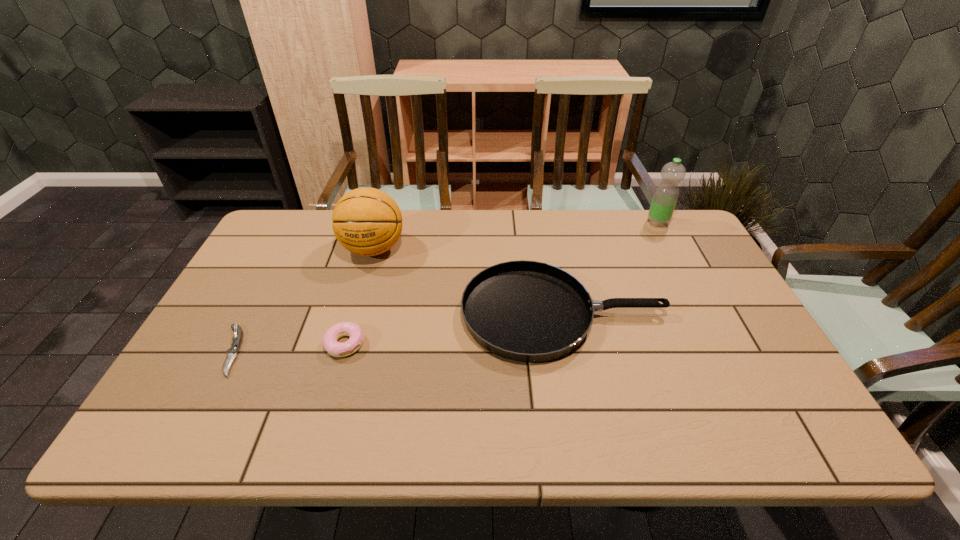
I want to click on blank area located 0.170m on the handle side of the third tallest object, so click(x=728, y=314).

Where is `free space located on the back of the doughnut`? The height and width of the screenshot is (540, 960). free space located on the back of the doughnut is located at coordinates (371, 254).

Find the location of `free region located on the right of the shortest object`. free region located on the right of the shortest object is located at coordinates (295, 351).

Locate an element on the screen. Image resolution: width=960 pixels, height=540 pixels. water bottle that is at the far edge is located at coordinates (665, 197).

Image resolution: width=960 pixels, height=540 pixels. I want to click on basketball that is at the far edge, so pos(366,221).

You are a GUI agent. You are given a task and a screenshot of the screen. Output one action in this format:
    pyautogui.click(x=<x>, y=<y>)
    Task: Click on the object present at the left edge
    
    Given the screenshot: What is the action you would take?
    pyautogui.click(x=237, y=339)

This screenshot has width=960, height=540. Find the location of `object that is at the right edge`. object that is at the right edge is located at coordinates (665, 197).

Image resolution: width=960 pixels, height=540 pixels. What are the coordinates of `object that is at the far right corner` in the screenshot? It's located at (665, 197).

Locate an element on the screen. vacant space at the far edge of the desktop is located at coordinates (578, 249).

In the image, there is a desktop. Identify the location of vacant space at the near edge. The height and width of the screenshot is (540, 960). (453, 429).